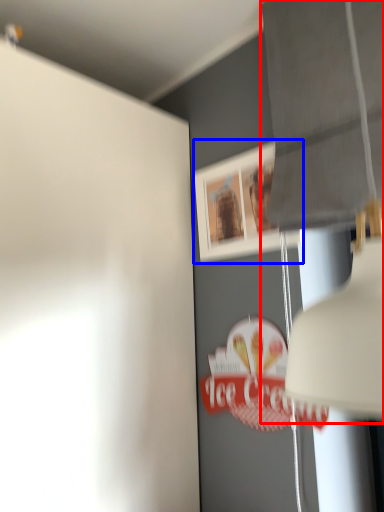
Question: Which point is closer to the camera, lamp (highlighted by a red box) or picture frame (highlighted by a blue box)?

Choices:
 (A) lamp
 (B) picture frame

Answer: (A)